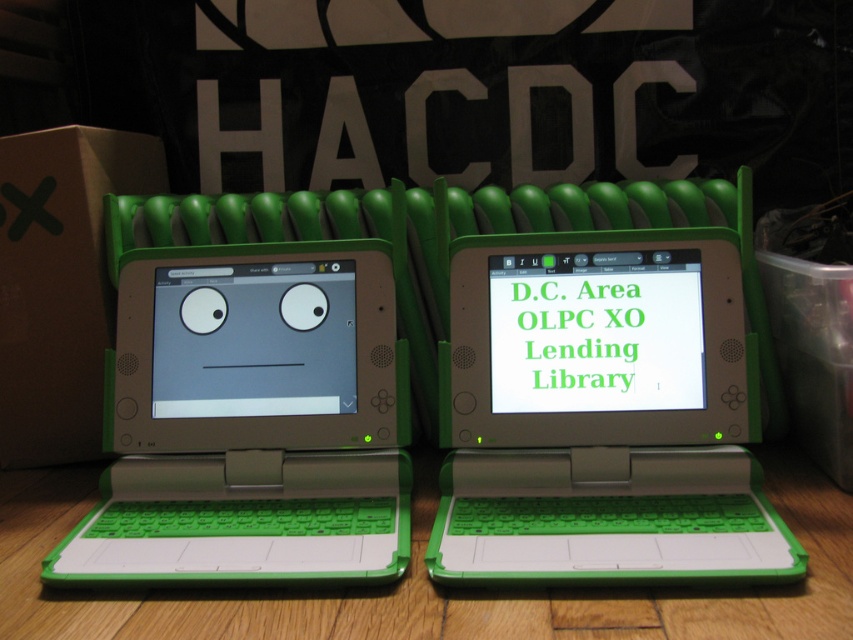
You are a student sitting in front of the two XO laptops. You notice two points on their screens. The first point is at coordinates point (x=637, y=240) and the second point is at point (x=698, y=588). Which point is closer to you?

Point (x=637, y=240) is further to the viewer than point (x=698, y=588). Therefore, the point closer to you is point (x=698, y=588).

You are a student trying to organize your desk. You have a green matte laptop at center and a green plastic laptops at center on your desk. Which one is positioned higher up?

The green matte laptop at center is positioned higher up because it is located above the green plastic laptops at center.